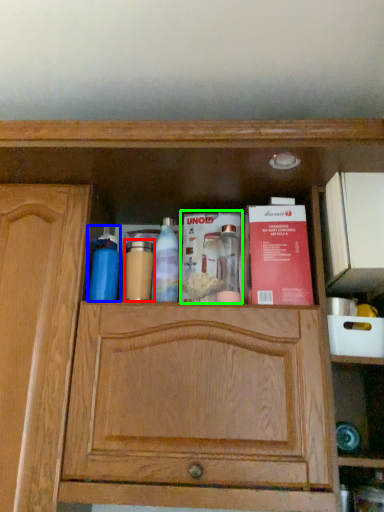
Question: Which object is positioned farthest from toiletry (highlighted by a red box)? Select from cleaning product (highlighted by a blue box) and book (highlighted by a green box).

Choices:
 (A) cleaning product
 (B) book

Answer: (B)